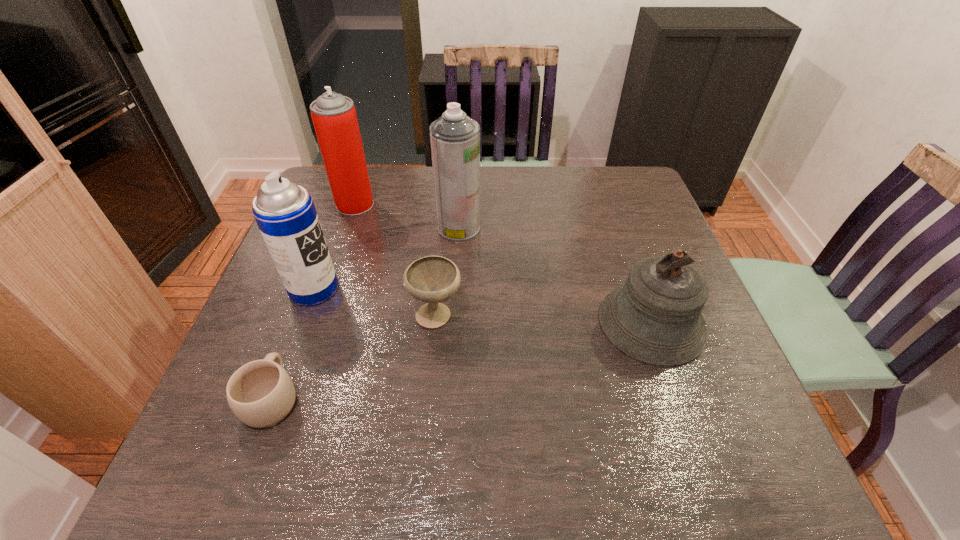
Locate an element on the screen. The image size is (960, 540). vacant area that satisfies the following two spatial constraints: 1. on the side of the mug with the handle; 2. on the right side of the chalice is located at coordinates click(303, 314).